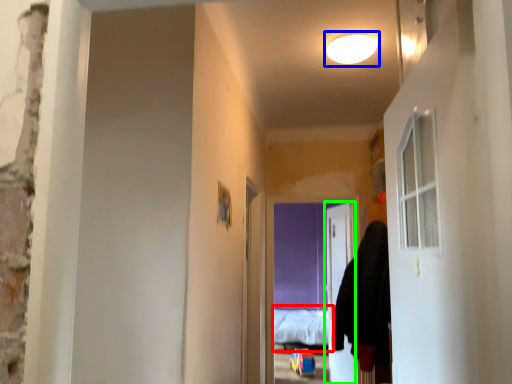
Question: Considering the real-world distances, which object is farthest from bed (highlighted by a red box)? light (highlighted by a blue box) or door (highlighted by a green box)?

Choices:
 (A) light
 (B) door

Answer: (A)